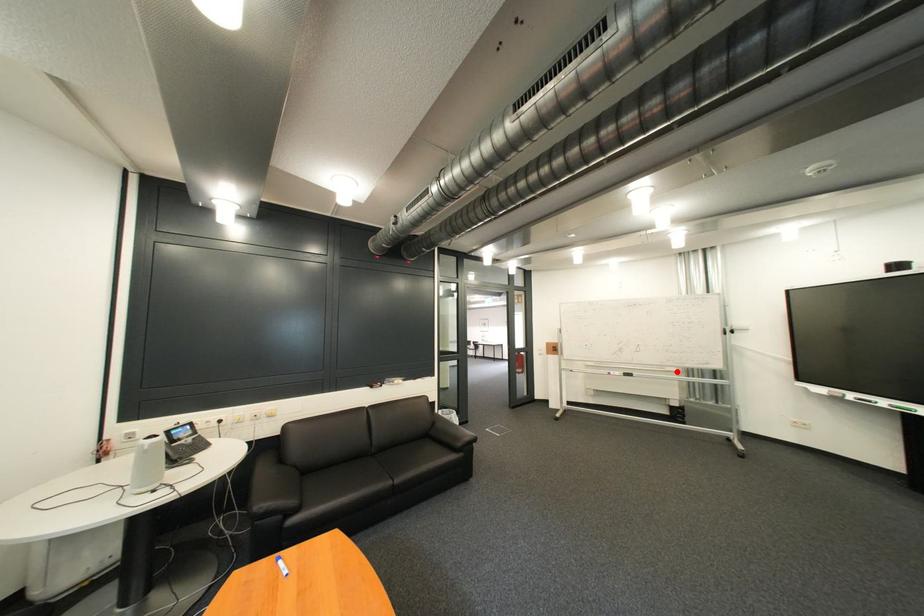
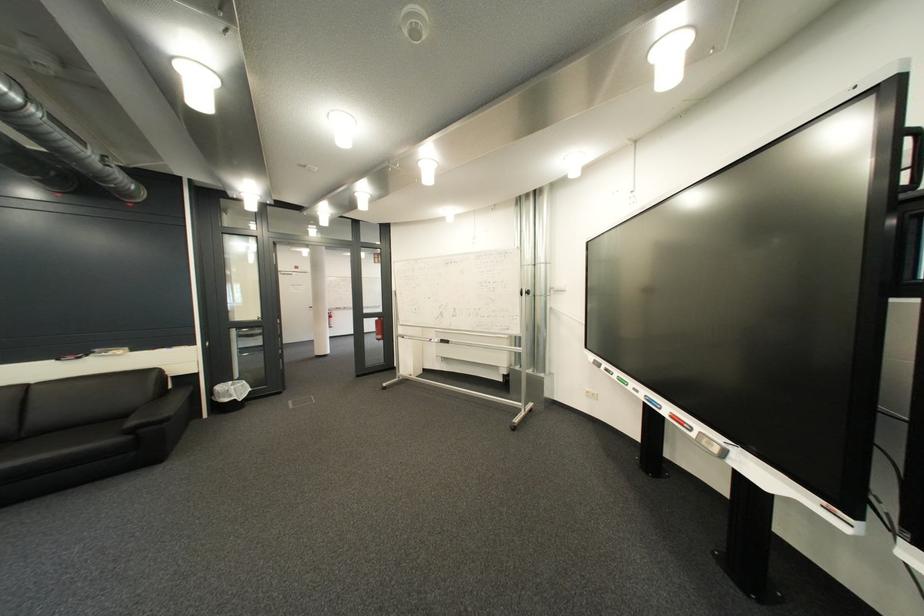
Question: I am providing you with two images of the same scene from different viewpoints. Image1 has a red point marked. In image2, the corresponding 3D location appears at what relative position? Reply with the corresponding letter.

Choices:
 (A) Closer
 (B) Farther

Answer: (B)